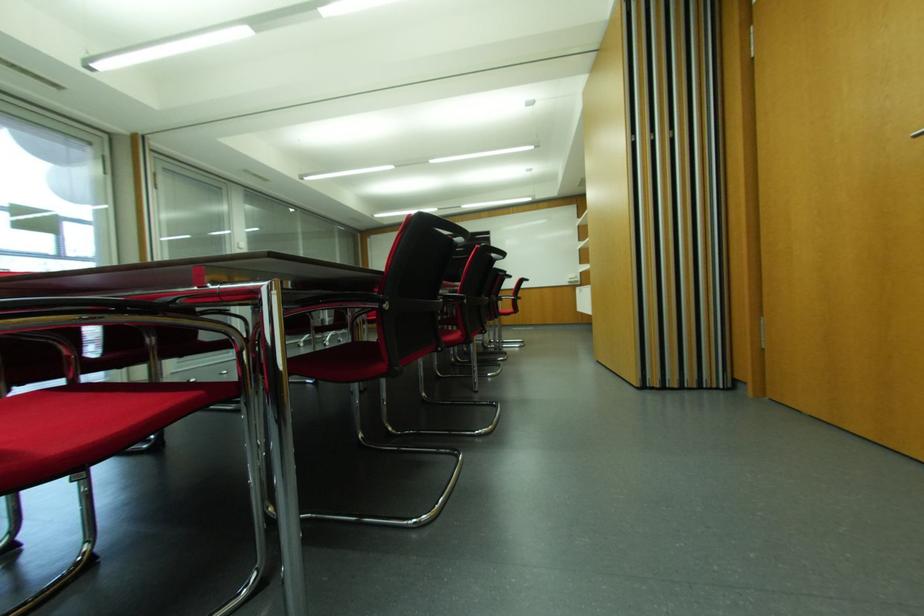
Where would you turn the silver door handle? Please return your answer as a coordinate pair (x, y).

(917, 134)